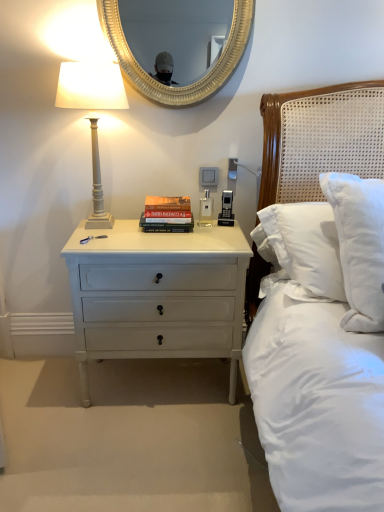
Question: Is white painted wood bedside lamp at left positioned before gold textured mirror at upper center?

Choices:
 (A) yes
 (B) no

Answer: (A)

Question: Is the depth of white painted wood bedside lamp at left greater than that of gold textured mirror at upper center?

Choices:
 (A) yes
 (B) no

Answer: (B)

Question: From the image's perspective, is white painted wood bedside lamp at left located beneath gold textured mirror at upper center?

Choices:
 (A) no
 (B) yes

Answer: (B)

Question: Is white painted wood bedside lamp at left shorter than gold textured mirror at upper center?

Choices:
 (A) no
 (B) yes

Answer: (A)

Question: Can you confirm if white painted wood bedside lamp at left is bigger than gold textured mirror at upper center?

Choices:
 (A) yes
 (B) no

Answer: (A)

Question: Is hardcover book at center to the left or to the right of gold textured mirror at upper center in the image?

Choices:
 (A) right
 (B) left

Answer: (B)

Question: Considering their positions, is hardcover book at center located in front of or behind gold textured mirror at upper center?

Choices:
 (A) front
 (B) behind

Answer: (B)

Question: From their relative heights in the image, would you say hardcover book at center is taller or shorter than gold textured mirror at upper center?

Choices:
 (A) short
 (B) tall

Answer: (A)

Question: Is point (167, 226) positioned closer to the camera than point (180, 74)?

Choices:
 (A) farther
 (B) closer

Answer: (B)

Question: In terms of size, does white painted wood nightstand at lower left appear bigger or smaller than hardcover book at center?

Choices:
 (A) small
 (B) big

Answer: (B)

Question: From the image's perspective, is white painted wood nightstand at lower left above or below hardcover book at center?

Choices:
 (A) above
 (B) below

Answer: (B)

Question: Considering the positions of white painted wood nightstand at lower left and hardcover book at center in the image, is white painted wood nightstand at lower left taller or shorter than hardcover book at center?

Choices:
 (A) short
 (B) tall

Answer: (B)

Question: Visually, is white painted wood nightstand at lower left positioned to the left or to the right of hardcover book at center?

Choices:
 (A) right
 (B) left

Answer: (B)

Question: From a real-world perspective, is white painted wood nightstand at lower left positioned above or below gold textured mirror at upper center?

Choices:
 (A) above
 (B) below

Answer: (B)

Question: Is white painted wood nightstand at lower left spatially inside gold textured mirror at upper center, or outside of it?

Choices:
 (A) outside
 (B) inside

Answer: (A)